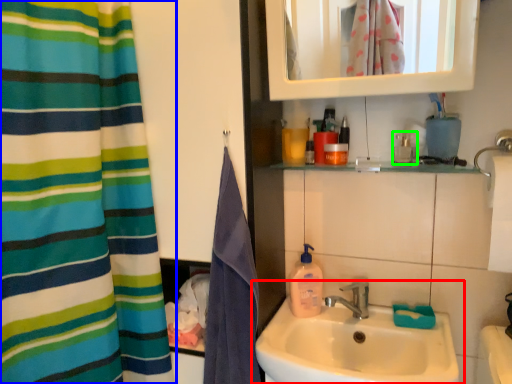
Question: Considering the real-world distances, which object is closest to sink (highlighted by a red box)? curtain (highlighted by a blue box) or mouthwash (highlighted by a green box).

Choices:
 (A) curtain
 (B) mouthwash

Answer: (B)